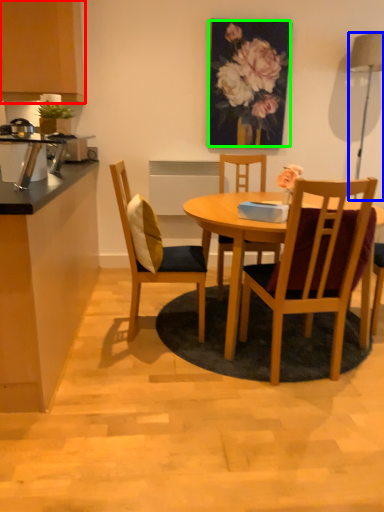
Question: Which object is positioned closest to cabinetry (highlighted by a red box)? Select from lamp (highlighted by a blue box) and floral arrangement (highlighted by a green box).

Choices:
 (A) lamp
 (B) floral arrangement

Answer: (B)